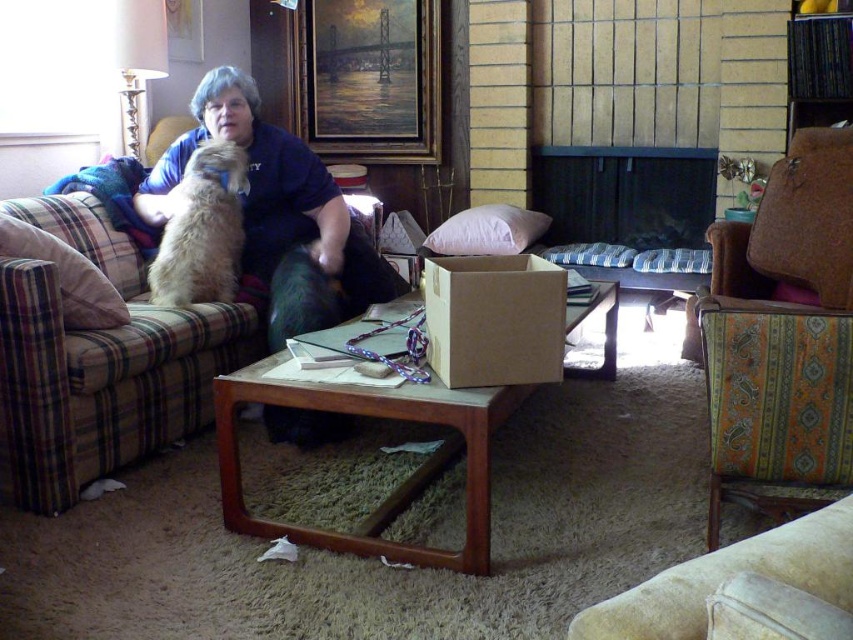
Is brown cardboard box at center thinner than fuzzy beige dog at upper left?

Yes, brown cardboard box at center is thinner than fuzzy beige dog at upper left.

Who is positioned more to the right, brown cardboard box at center or fuzzy beige dog at upper left?

Positioned to the right is brown cardboard box at center.

Which is behind, point (514, 257) or point (161, 300)?

The point (161, 300) is more distant.

Find the location of a particular element. This screenshot has width=853, height=640. brown cardboard box at center is located at coordinates (494, 320).

Is point (93, 202) positioned in front of point (793, 497)?

No.

Can you confirm if plaid fabric couch at left is taller than patterned fabric chair at lower right?

Indeed, plaid fabric couch at left has a greater height compared to patterned fabric chair at lower right.

This screenshot has width=853, height=640. What do you see at coordinates (100, 385) in the screenshot?
I see `plaid fabric couch at left` at bounding box center [100, 385].

This screenshot has width=853, height=640. What are the coordinates of `plaid fabric couch at left` in the screenshot? It's located at (100, 385).

Who is shorter, plaid fabric couch at left or plaid fabric pillow at left?

With less height is plaid fabric pillow at left.

Can you confirm if plaid fabric couch at left is positioned to the right of plaid fabric pillow at left?

Yes, plaid fabric couch at left is to the right of plaid fabric pillow at left.

At what (x,y) coordinates should I click in order to perform the action: click on plaid fabric couch at left. Please return your answer as a coordinate pair (x, y). Looking at the image, I should click on (100, 385).